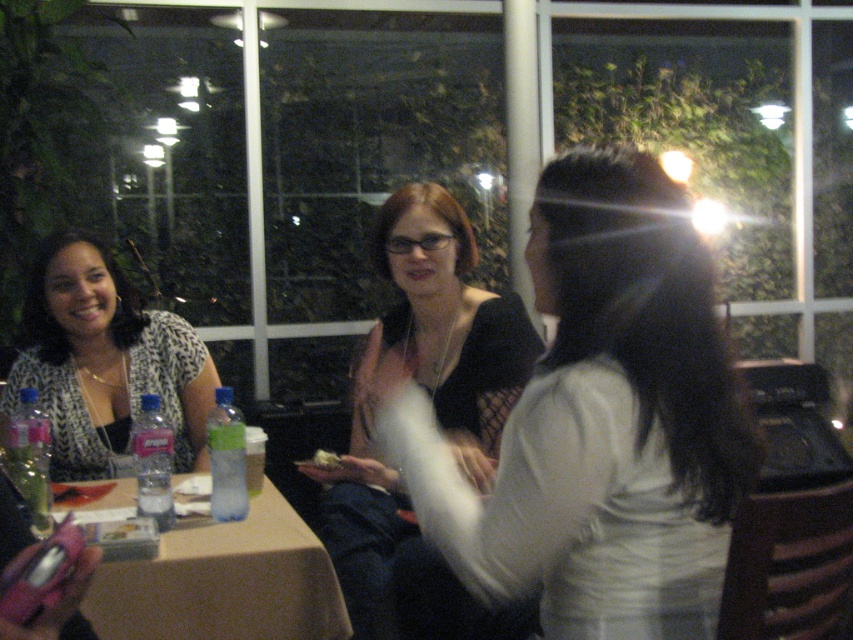
Does point (415, 596) come farther from viewer compared to point (70, 301)?

No, it is in front of (70, 301).

Does matte black top at center have a greater height compared to printed fabric blouse at left?

Yes, matte black top at center is taller than printed fabric blouse at left.

The height and width of the screenshot is (640, 853). I want to click on matte black top at center, so click(x=421, y=385).

The image size is (853, 640). I want to click on matte black top at center, so click(x=421, y=385).

Does matte black top at center come in front of brown paper table at lower left?

That is False.

Between matte black top at center and brown paper table at lower left, which one appears on the right side from the viewer's perspective?

matte black top at center

The height and width of the screenshot is (640, 853). I want to click on matte black top at center, so click(x=421, y=385).

Can you confirm if matte black shirt at center is shorter than brown paper table at lower left?

No.

Who is shorter, matte black shirt at center or brown paper table at lower left?

brown paper table at lower left

Find the location of a particular element. The width and height of the screenshot is (853, 640). matte black shirt at center is located at coordinates (595, 429).

Locate an element on the screen. The image size is (853, 640). matte black shirt at center is located at coordinates (595, 429).